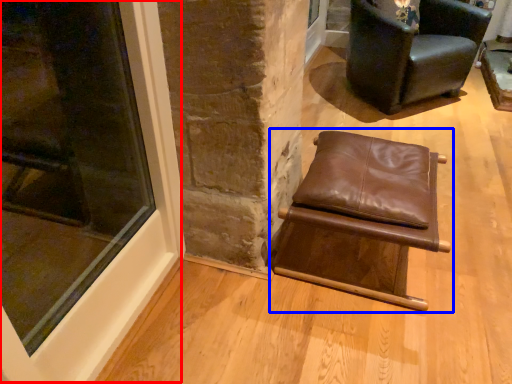
Question: Which of the following is the farthest to the observer, window (highlighted by a red box) or chair (highlighted by a blue box)?

Choices:
 (A) window
 (B) chair

Answer: (B)